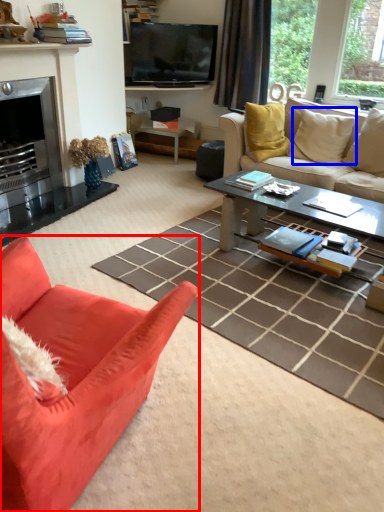
Question: Which object is further to the camera taking this photo, studio couch (highlighted by a red box) or pillow (highlighted by a blue box)?

Choices:
 (A) studio couch
 (B) pillow

Answer: (B)